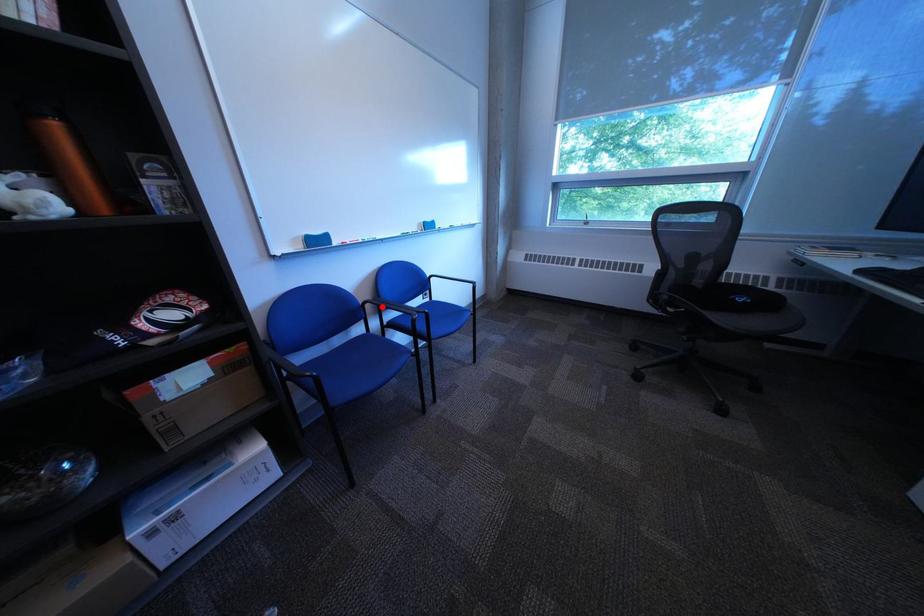
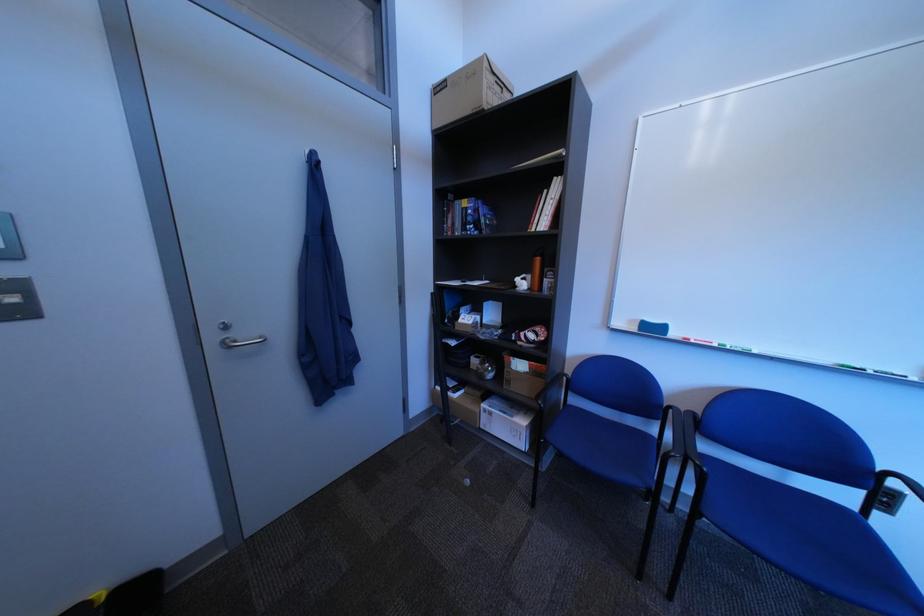
Question: I am providing you with two images of the same scene from different viewpoints. A red point is marked on the first image. At the location where the point appears in image 1, is it still visible in image 2?

Choices:
 (A) Yes
 (B) No

Answer: (A)